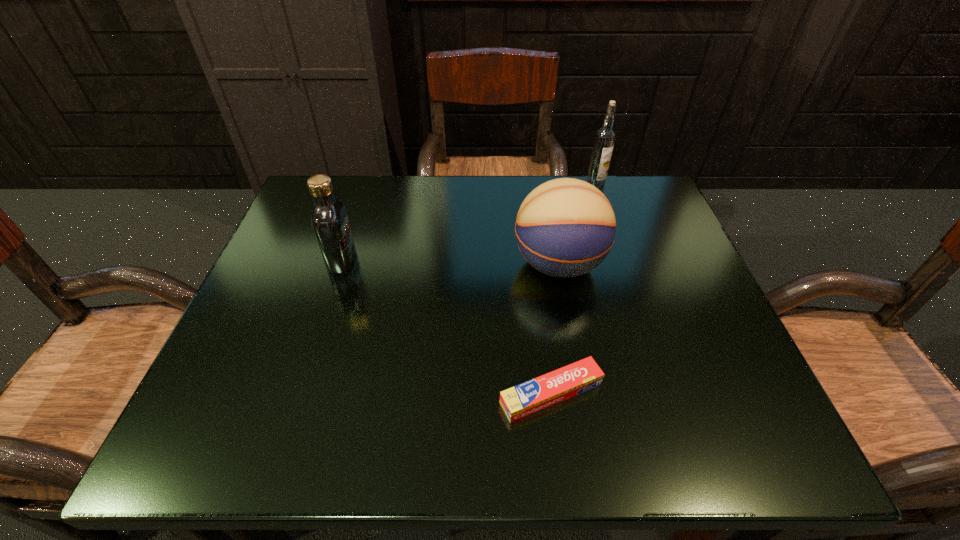
Locate an element on the screen. The image size is (960, 540). the right vodka is located at coordinates (605, 137).

Identify the location of the farthest object. (605, 137).

You are a GUI agent. You are given a task and a screenshot of the screen. Output one action in this format:
    pyautogui.click(x=<x>, y=<y>)
    Task: Click on the nearer vodka
    This screenshot has width=960, height=540.
    Given the screenshot: What is the action you would take?
    pyautogui.click(x=330, y=222)

Identify the location of the leftmost object. The height and width of the screenshot is (540, 960). (330, 222).

This screenshot has height=540, width=960. In order to click on basketball in this screenshot , I will do `click(565, 227)`.

You are a GUI agent. You are given a task and a screenshot of the screen. Output one action in this format:
    pyautogui.click(x=<x>, y=<y>)
    Task: Click on the shortest object
    
    Given the screenshot: What is the action you would take?
    pyautogui.click(x=524, y=399)

Where is `the nearest object`? The height and width of the screenshot is (540, 960). the nearest object is located at coordinates (524, 399).

Locate an element on the screen. This screenshot has width=960, height=540. vacant space positioned 0.050m on the label of the right vodka is located at coordinates (601, 201).

The image size is (960, 540). I want to click on vacant space located on the front-facing side of the nearer vodka, so click(x=416, y=260).

Image resolution: width=960 pixels, height=540 pixels. Find the location of `vacant space located 0.070m on the patterned surface of the basketball`. vacant space located 0.070m on the patterned surface of the basketball is located at coordinates (479, 265).